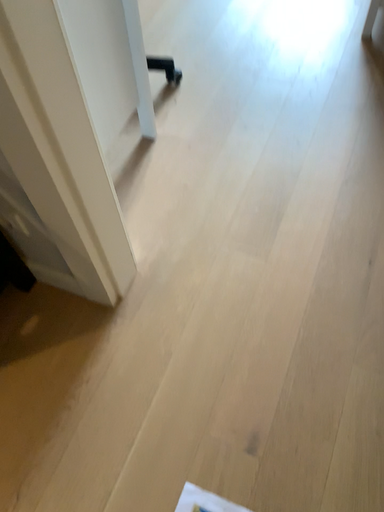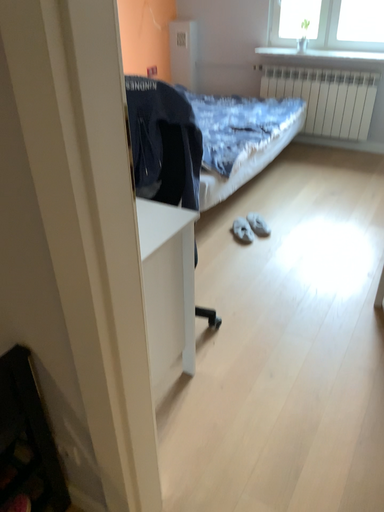
Question: How did the camera likely rotate when shooting the video?

Choices:
 (A) rotated upward
 (B) rotated downward

Answer: (A)